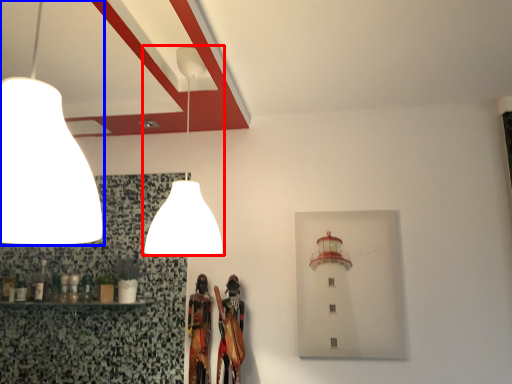
Question: Which of the following is the closest to the observer, lamp (highlighted by a red box) or lamp (highlighted by a blue box)?

Choices:
 (A) lamp
 (B) lamp

Answer: (B)